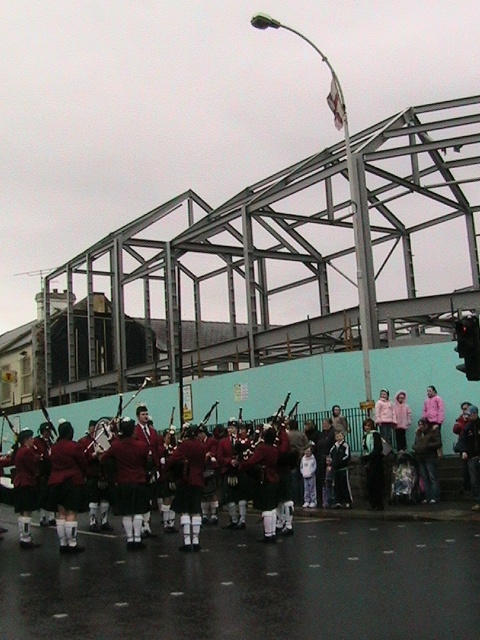
You are a photographer trying to capture the band members in the center of the image. You notice the red woolen sweater at center and the shiny red bagpipes at center. Which object should you focus on if you want to highlight something taller in your photo?

The shiny red bagpipes at center are taller than the red woolen sweater at center, so focusing on the shiny red bagpipes at center would highlight the taller object.

You are standing on the street and see two points marked on the ground in front of you. The first is labeled as point (219, 403) and the second as point (137, 451). Which point is closer to your current position?

Point (219, 403) is further to the viewer than point (137, 451), so the closer point to your current position is point (137, 451).

You are standing at the point with coordinates (453, 440) in the image. What object are you looking at?

The point corresponds to maroon woolen jackets at center.